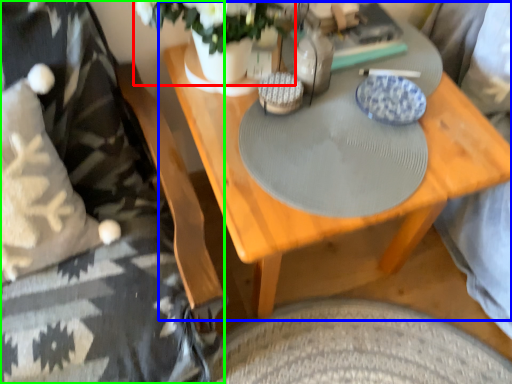
Question: Considering the real-world distances, which object is farthest from floral arrangement (highlighted by a red box)? table (highlighted by a blue box) or bedding (highlighted by a green box)?

Choices:
 (A) table
 (B) bedding

Answer: (B)